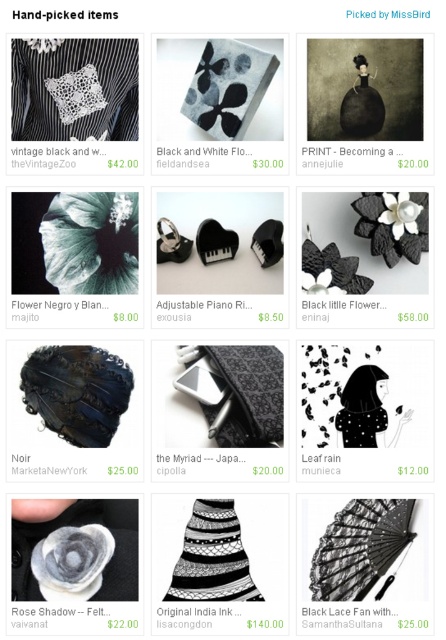
Is black lace crochet at center thinner than dark blue lace crochet at center?

Incorrect, black lace crochet at center's width is not less than dark blue lace crochet at center's.

Between black lace crochet at center and dark blue lace crochet at center, which one appears on the right side from the viewer's perspective?

From the viewer's perspective, black lace crochet at center appears more on the right side.

Between point (280, 428) and point (61, 355), which one is positioned behind?

The point (280, 428) is more distant.

Identify the location of black lace crochet at center. (236, 392).

Who is more forward, [198,403] or [228,588]?

Positioned in front is point [228,588].

Which is above, black lace crochet at center or black and white crochet at center?

Positioned higher is black lace crochet at center.

Who is more distant from viewer, [206,364] or [177,580]?

The point [206,364] is behind.

You are a GUI agent. You are given a task and a screenshot of the screen. Output one action in this format:
    pyautogui.click(x=<x>, y=<y>)
    Task: Click on the black lace crochet at center
    Image resolution: width=446 pixels, height=640 pixels.
    Given the screenshot: What is the action you would take?
    pyautogui.click(x=236, y=392)

Looking at this image, is black and white crochet at center shorter than black felt hat at center?

Incorrect, black and white crochet at center's height does not fall short of black felt hat at center's.

Does point (201, 516) come farther from viewer compared to point (263, 262)?

No.

Locate an element on the screen. black and white crochet at center is located at coordinates (213, 557).

At what (x,y) coordinates should I click in order to perform the action: click on black and white crochet at center. Please return your answer as a coordinate pair (x, y). Looking at the image, I should click on (213, 557).